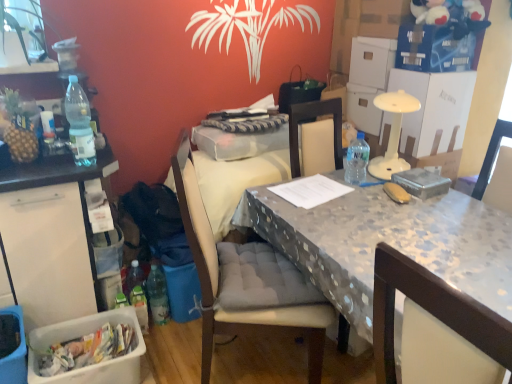
The image size is (512, 384). In order to click on vacant point to the right of transparent plastic bottle at table right, arranged as the second bottle when ordered from the bottom in this screenshot , I will do `click(385, 172)`.